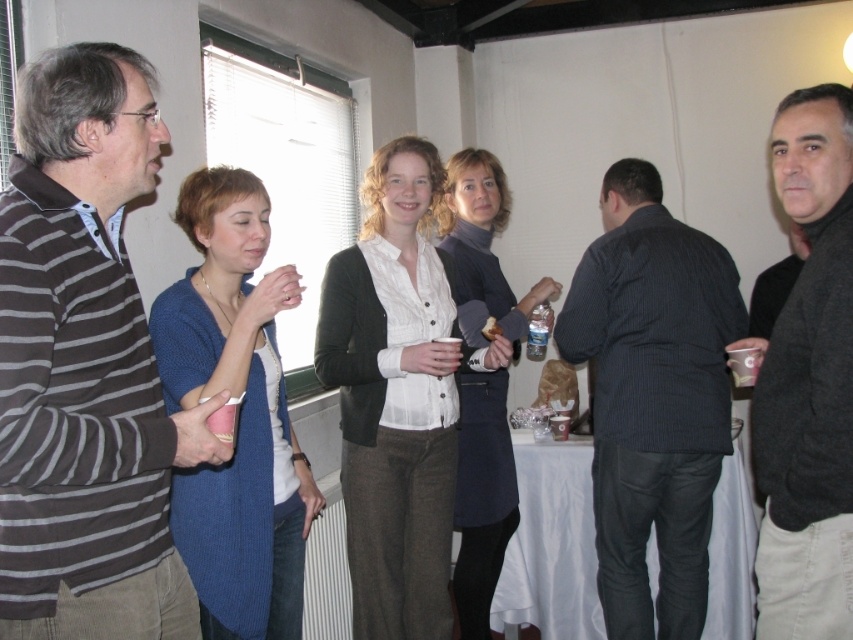
Question: Is dark gray sweater at right to the left of matte plastic cup at lower left from the viewer's perspective?

Choices:
 (A) yes
 (B) no

Answer: (B)

Question: Which is farther from the dark gray sweater at right?

Choices:
 (A) clear plastic cup at upper right
 (B) matte white blouse at center
 (C) striped knit sweater at left
 (D) clear plastic bottle at center

Answer: (D)

Question: Can you confirm if matte white blouse at center is thinner than clear plastic bottle at center?

Choices:
 (A) no
 (B) yes

Answer: (A)

Question: Is dark gray sweater at center to the left of clear plastic cup at upper right from the viewer's perspective?

Choices:
 (A) yes
 (B) no

Answer: (A)

Question: Considering the real-world distances, which object is closest to the clear plastic bottle at center?

Choices:
 (A) matte plastic cup at lower left
 (B) matte white blouse at center
 (C) dark gray striped shirt at center

Answer: (C)

Question: Based on their relative distances, which object is nearer to the dark gray sweater at right?

Choices:
 (A) matte plastic cup at lower left
 (B) clear plastic bottle at center
 (C) dark gray sweater at center

Answer: (C)